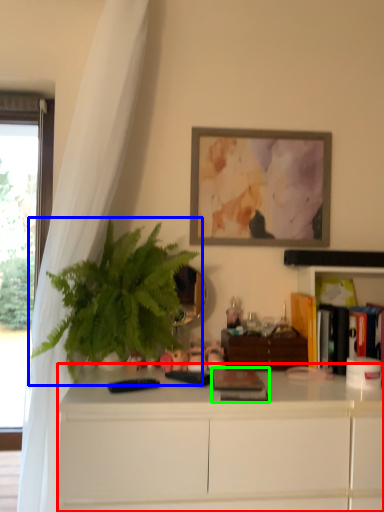
Question: Which is nearer to the cabinetry (highlighted by a red box)? houseplant (highlighted by a blue box) or book (highlighted by a green box).

Choices:
 (A) houseplant
 (B) book

Answer: (B)